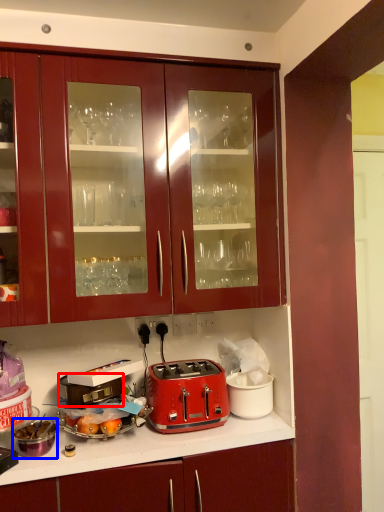
Question: Which object is further to the camera taking this photo, appliance (highlighted by a red box) or appliance (highlighted by a blue box)?

Choices:
 (A) appliance
 (B) appliance

Answer: (A)